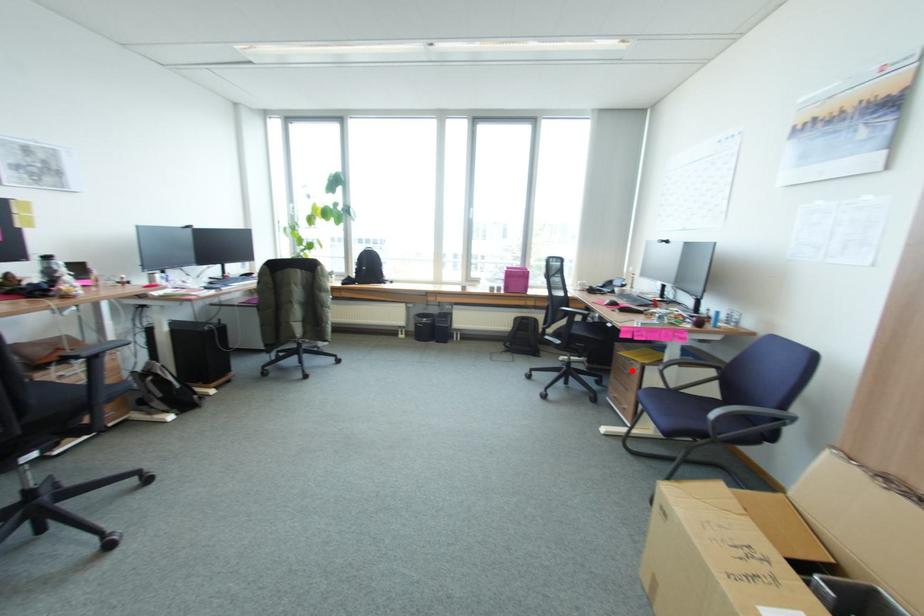
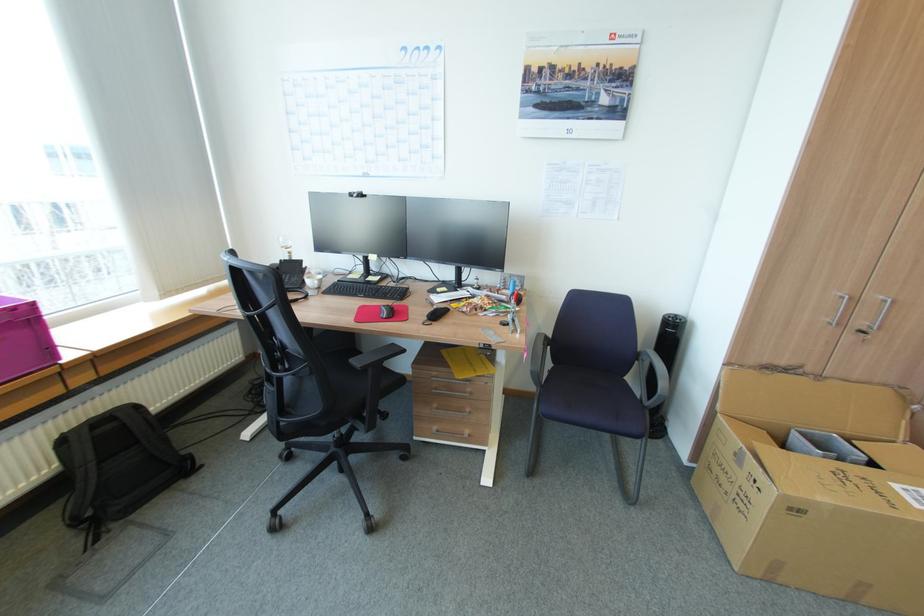
Find the pixel in the second image that matches the highlighted location in the first image.

(469, 392)